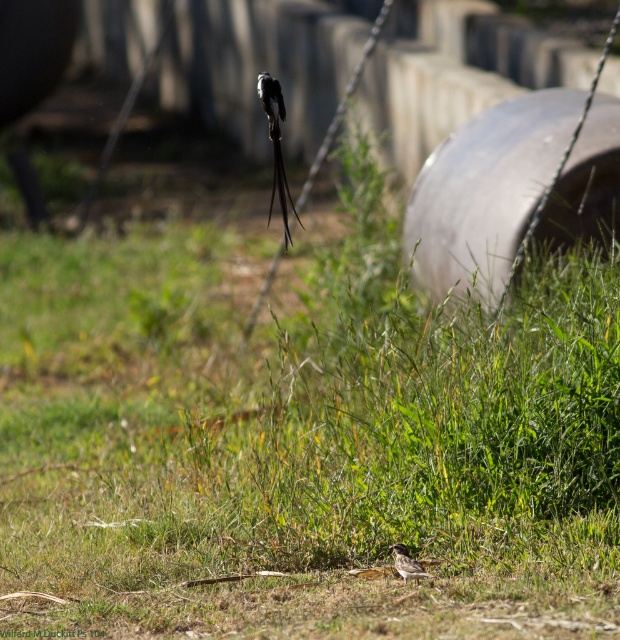
Describe the element at coordinates (275, 147) in the screenshot. The image size is (620, 640). I see `silvery metallic bird at center` at that location.

From the picture: Does silvery metallic bird at center appear over brown speckled bird at center?

Yes.

Is point (262, 88) positioned after point (417, 576)?

That is True.

Locate an element on the screen. The width and height of the screenshot is (620, 640). silvery metallic bird at center is located at coordinates (275, 147).